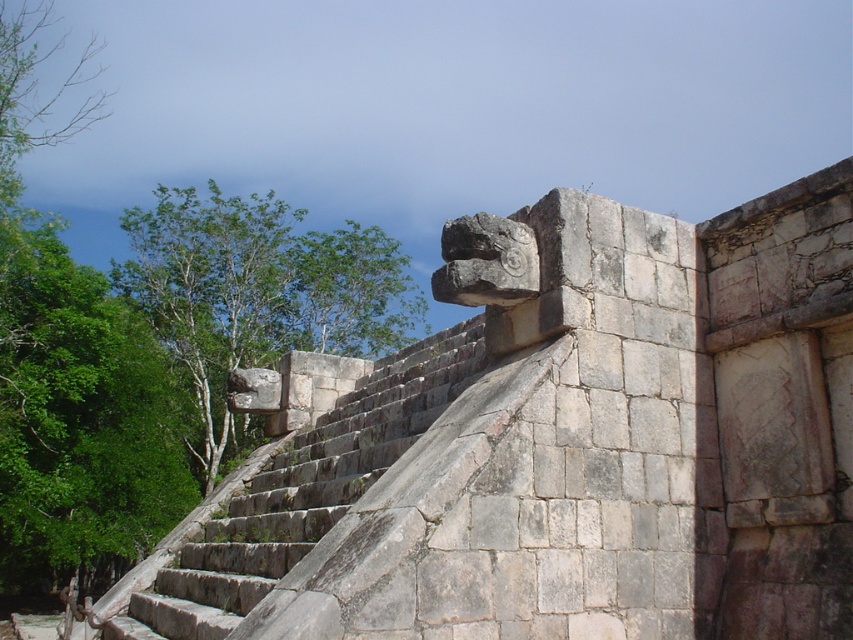
Is gray stone carving at upper center thinner than green leafy tree at left?

Yes.

Can you confirm if gray stone carving at upper center is taller than green leafy tree at left?

In fact, gray stone carving at upper center may be shorter than green leafy tree at left.

The width and height of the screenshot is (853, 640). Find the location of `gray stone carving at upper center`. gray stone carving at upper center is located at coordinates (553, 445).

You are a GUI agent. You are given a task and a screenshot of the screen. Output one action in this format:
    pyautogui.click(x=<x>, y=<y>)
    Task: Click on the gray stone carving at upper center
    
    Given the screenshot: What is the action you would take?
    pyautogui.click(x=553, y=445)

Based on the photo, can you confirm if green leafy tree at left is smaller than gray stone stairs at upper center?

Actually, green leafy tree at left might be larger than gray stone stairs at upper center.

Which of these two, green leafy tree at left or gray stone stairs at upper center, stands shorter?

With less height is gray stone stairs at upper center.

Locate an element on the screen. This screenshot has height=640, width=853. green leafy tree at left is located at coordinates (257, 296).

The width and height of the screenshot is (853, 640). What do you see at coordinates (553, 445) in the screenshot? I see `gray stone carving at upper center` at bounding box center [553, 445].

Is gray stone carving at upper center bigger than gray stone stairs at upper center?

Indeed, gray stone carving at upper center has a larger size compared to gray stone stairs at upper center.

Who is more forward, [700,637] or [398,390]?

Point [700,637] is more forward.

I want to click on gray stone carving at upper center, so click(x=553, y=445).